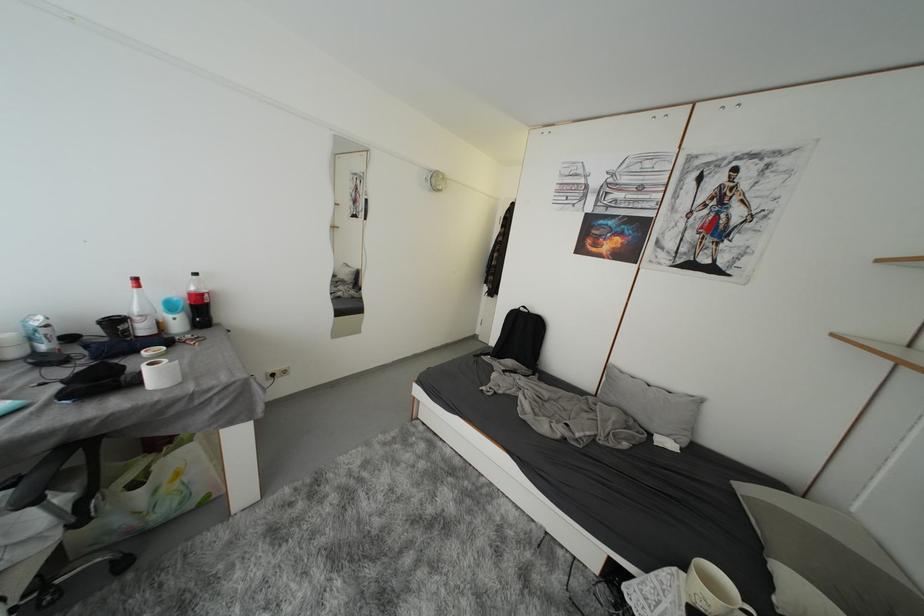
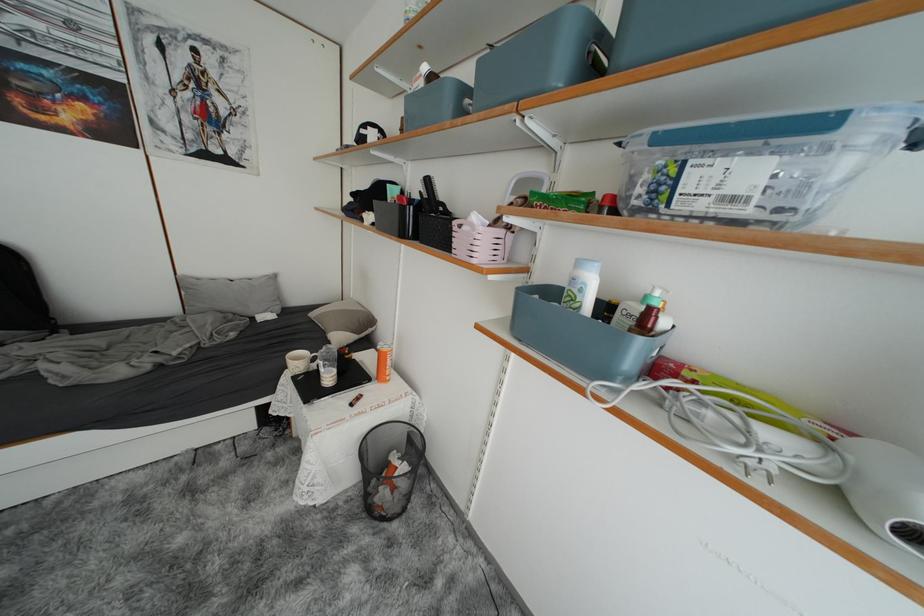
Where in the second image is the point corresponding to (x=658, y=386) from the first image?

(238, 281)